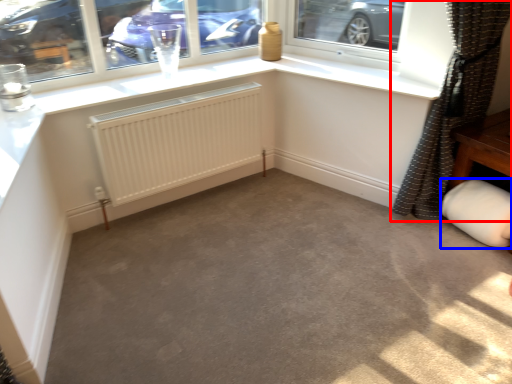
Question: Among these objects, which one is farthest to the camera, curtain (highlighted by a red box) or gray (highlighted by a blue box)?

Choices:
 (A) curtain
 (B) gray

Answer: (B)